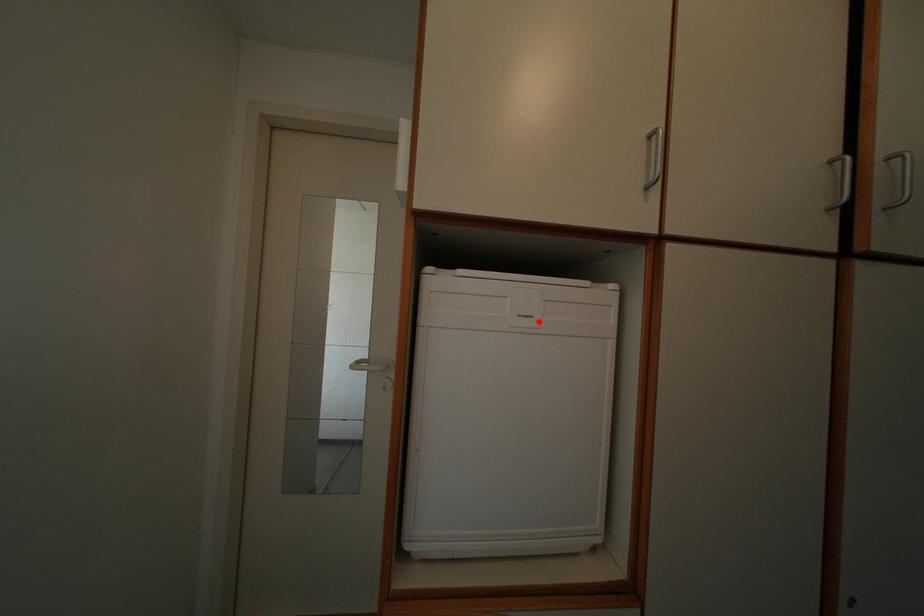
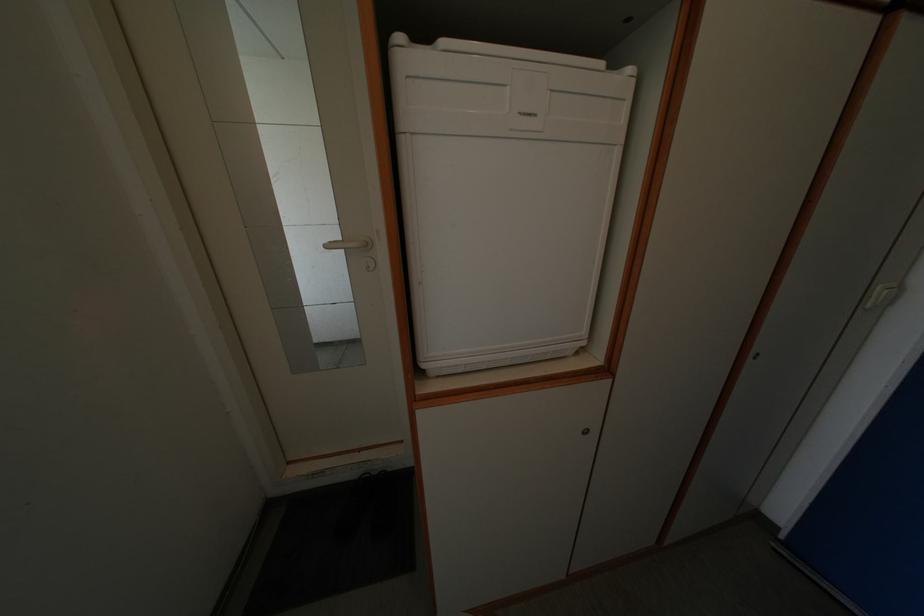
Locate, in the second image, the point that corresponds to the highlighted location in the first image.

(542, 120)